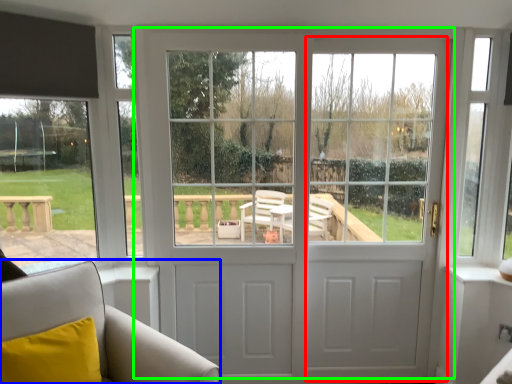
Question: Considering the real-world distances, which object is closest to screen door (highlighted by a red box)? furniture (highlighted by a blue box) or door (highlighted by a green box).

Choices:
 (A) furniture
 (B) door

Answer: (B)